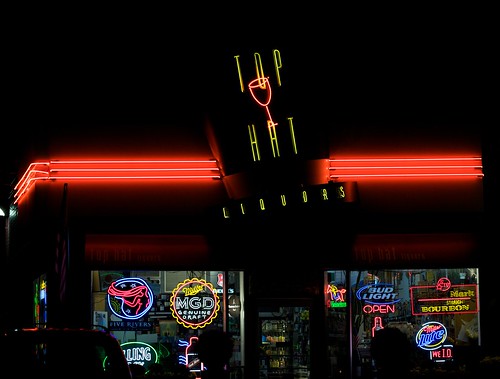
Where is `red lighting`? Image resolution: width=500 pixels, height=379 pixels. red lighting is located at coordinates (387, 161), (388, 168), (389, 175).